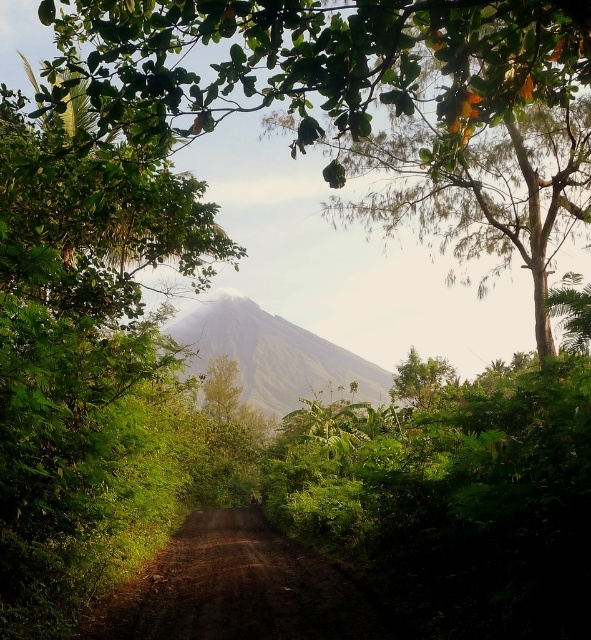
Question: Does green leafy tree at center appear under green grassy mountain at center?

Choices:
 (A) no
 (B) yes

Answer: (A)

Question: Is brown dirt track at center below green grassy mountain at center?

Choices:
 (A) no
 (B) yes

Answer: (B)

Question: Is brown dirt track at center smaller than green grassy mountain at center?

Choices:
 (A) no
 (B) yes

Answer: (B)

Question: Which object appears closest to the camera in this image?

Choices:
 (A) brown dirt track at center
 (B) green grassy mountain at center

Answer: (A)

Question: Estimate the real-world distances between objects in this image. Which object is farther from the green leafy tree at center?

Choices:
 (A) green grassy mountain at center
 (B) brown dirt track at center

Answer: (A)

Question: Which object is closer to the camera taking this photo?

Choices:
 (A) green grassy mountain at center
 (B) green leafy tree at center
 (C) brown dirt track at center

Answer: (B)